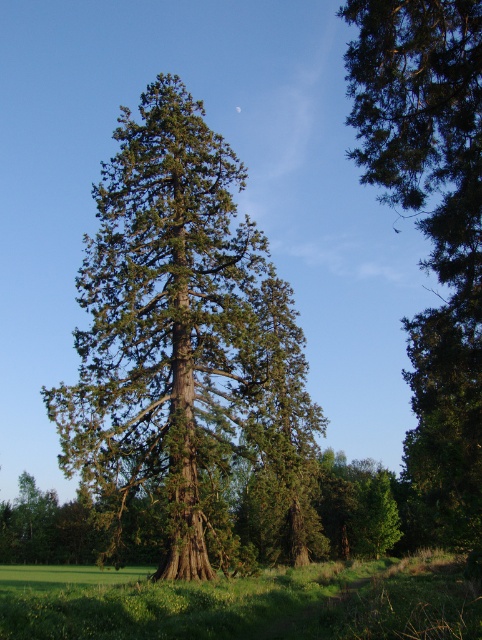
Is green rough bark tree at center wider than green grassy field at lower center?

Incorrect, green rough bark tree at center's width does not surpass green grassy field at lower center's.

Between point (198, 106) and point (308, 605), which one is positioned behind?

The point (198, 106) is more distant.

Locate an element on the screen. The width and height of the screenshot is (482, 640). green rough bark tree at center is located at coordinates (188, 358).

Locate an element on the screen. green rough bark tree at center is located at coordinates (188, 358).

Is green rough bark tree at center positioned before green textured tree at right?

No, green rough bark tree at center is behind green textured tree at right.

Which is behind, point (242, 339) or point (377, 168)?

Point (242, 339)

The image size is (482, 640). What are the coordinates of `green rough bark tree at center` in the screenshot? It's located at (188, 358).

Between point (426, 356) and point (76, 595), which one is positioned in front?

Point (426, 356) is in front.

Can you confirm if green textured tree at right is positioned to the left of green grassy field at lower center?

No, green textured tree at right is not to the left of green grassy field at lower center.

Image resolution: width=482 pixels, height=640 pixels. Describe the element at coordinates (431, 230) in the screenshot. I see `green textured tree at right` at that location.

The image size is (482, 640). Find the location of `green textured tree at right`. green textured tree at right is located at coordinates (431, 230).